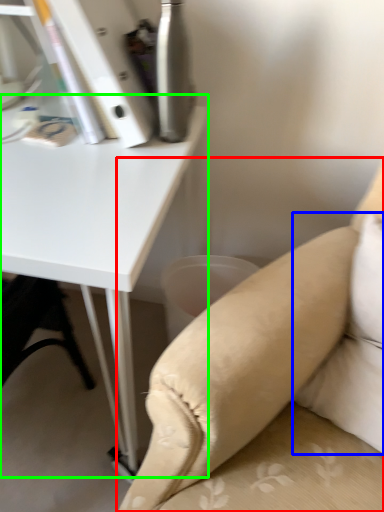
Question: Which object is positioned closest to studio couch (highlighted by a red box)? Select from pillow (highlighted by a blue box) and table (highlighted by a green box).

Choices:
 (A) pillow
 (B) table

Answer: (A)